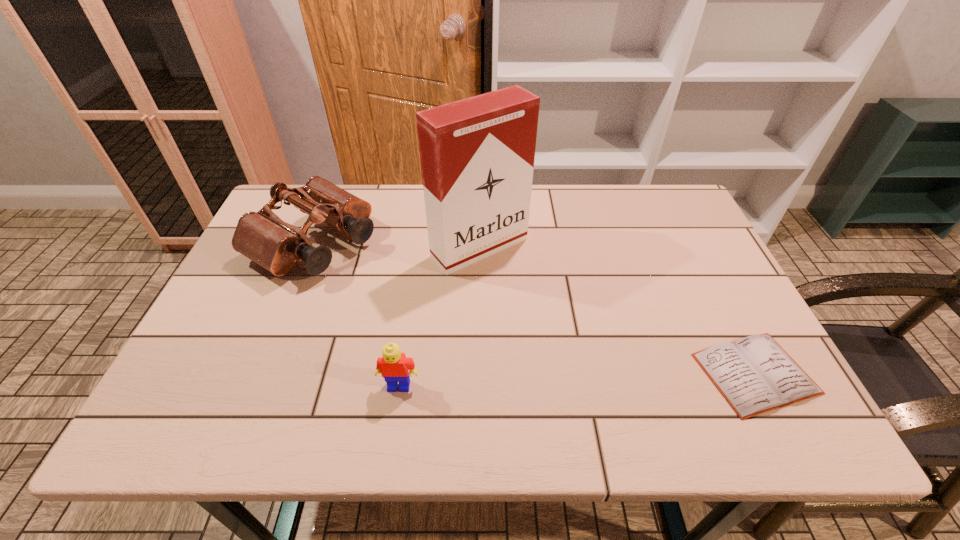
Identify the location of vacant spot on the desktop that is between the third tallest object and the rightmost object and is positioned on the front-facing side of the cigarette_case. (611, 379).

The height and width of the screenshot is (540, 960). I want to click on vacant space on the desktop that is between the third tallest object and the shortest object and is positioned through the eyepieces of the leftmost object, so pos(545,381).